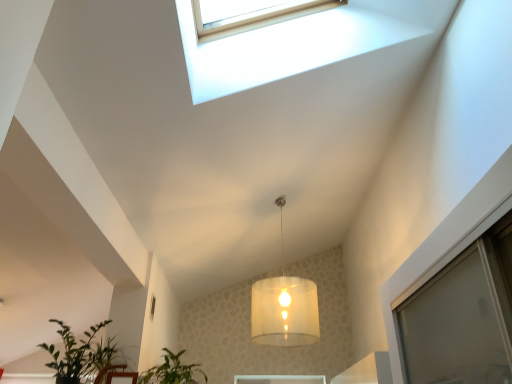
Question: From a real-world perspective, is green leafy plant at lower left, the first houseplant viewed from the left, beneath translucent fabric lampshade at center?

Choices:
 (A) yes
 (B) no

Answer: (A)

Question: From a real-world perspective, is green leafy plant at lower left, which is counted as the 2th houseplant, starting from the right, over translucent fabric lampshade at center?

Choices:
 (A) no
 (B) yes

Answer: (A)

Question: From the image's perspective, would you say green leafy plant at lower left, the first houseplant viewed from the left, is shown under translucent fabric lampshade at center?

Choices:
 (A) no
 (B) yes

Answer: (B)

Question: Is green leafy plant at lower left, which is counted as the 2th houseplant, starting from the right, shorter than translucent fabric lampshade at center?

Choices:
 (A) no
 (B) yes

Answer: (B)

Question: Considering the relative positions of green leafy plant at lower left, the first houseplant viewed from the left, and translucent fabric lampshade at center in the image provided, is green leafy plant at lower left, the first houseplant viewed from the left, to the left of translucent fabric lampshade at center from the viewer's perspective?

Choices:
 (A) yes
 (B) no

Answer: (A)

Question: Considering the positions of point (53, 357) and point (252, 329), is point (53, 357) closer or farther from the camera than point (252, 329)?

Choices:
 (A) closer
 (B) farther

Answer: (A)

Question: In terms of size, does green leafy plant at lower left, the first houseplant viewed from the left, appear bigger or smaller than translucent fabric lampshade at center?

Choices:
 (A) big
 (B) small

Answer: (B)

Question: Would you say green leafy plant at lower left, the first houseplant viewed from the left, is inside or outside translucent fabric lampshade at center?

Choices:
 (A) outside
 (B) inside

Answer: (A)

Question: Based on their positions, is green leafy plant at lower left, which is counted as the 2th houseplant, starting from the right, located to the left or right of translucent fabric lampshade at center?

Choices:
 (A) right
 (B) left

Answer: (B)

Question: Considering the positions of green leafy plant at lower center, the first houseplant in the right-to-left sequence, and translucent fabric lampshade at center in the image, is green leafy plant at lower center, the first houseplant in the right-to-left sequence, bigger or smaller than translucent fabric lampshade at center?

Choices:
 (A) big
 (B) small

Answer: (B)

Question: Is point (173, 377) closer or farther from the camera than point (282, 296)?

Choices:
 (A) closer
 (B) farther

Answer: (A)

Question: Considering their positions, is green leafy plant at lower center, the first houseplant in the right-to-left sequence, located in front of or behind translucent fabric lampshade at center?

Choices:
 (A) behind
 (B) front

Answer: (B)

Question: From a real-world perspective, is green leafy plant at lower center, which ranks as the 2th houseplant in left-to-right order, physically located above or below translucent fabric lampshade at center?

Choices:
 (A) above
 (B) below

Answer: (B)

Question: Choose the correct answer: Is translucent fabric lampshade at center inside green leafy plant at lower left, the first houseplant viewed from the left, or outside it?

Choices:
 (A) outside
 (B) inside

Answer: (A)

Question: Relative to green leafy plant at lower left, the first houseplant viewed from the left, is translucent fabric lampshade at center in front or behind?

Choices:
 (A) behind
 (B) front

Answer: (A)